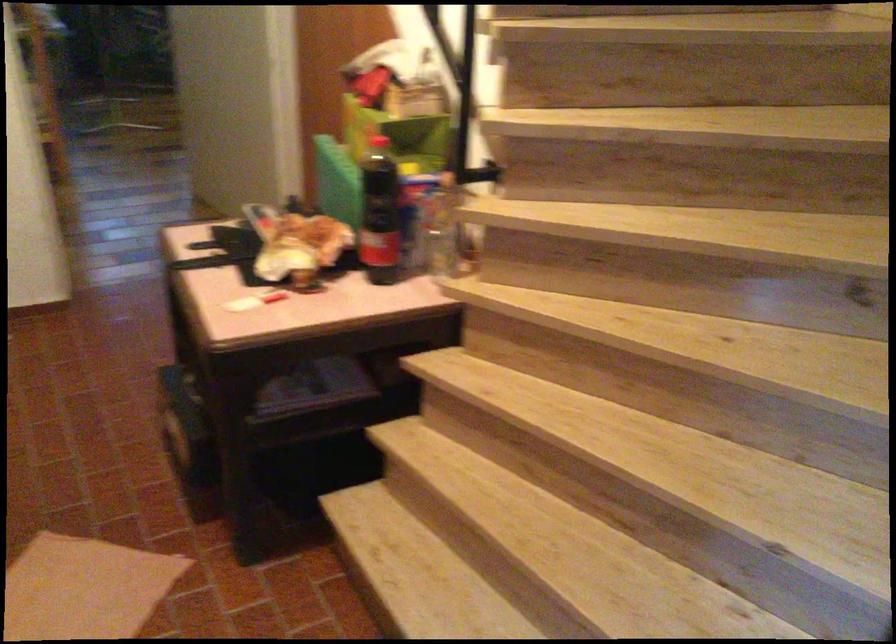
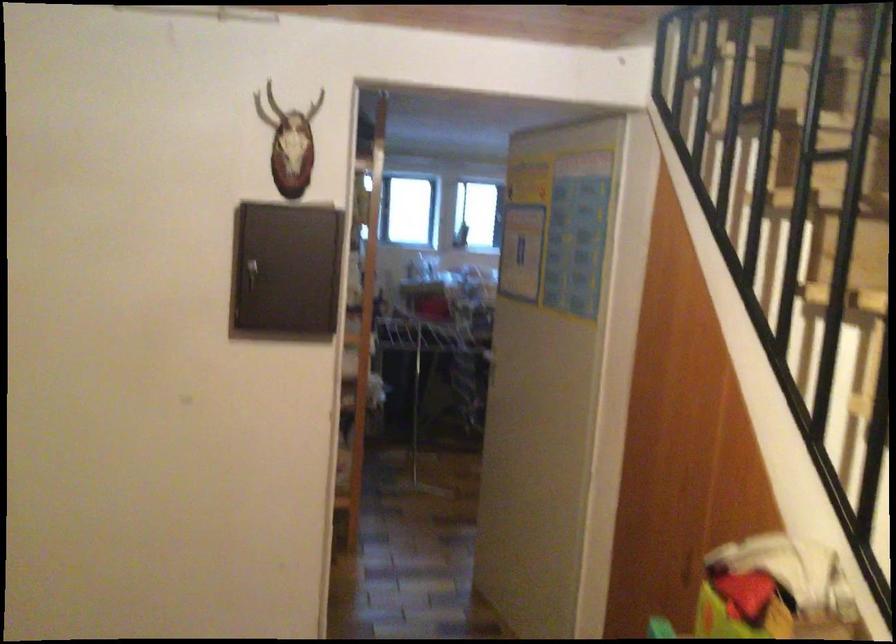
Based on the continuous images, in which direction is the camera rotating?

The camera rotated toward left-up.